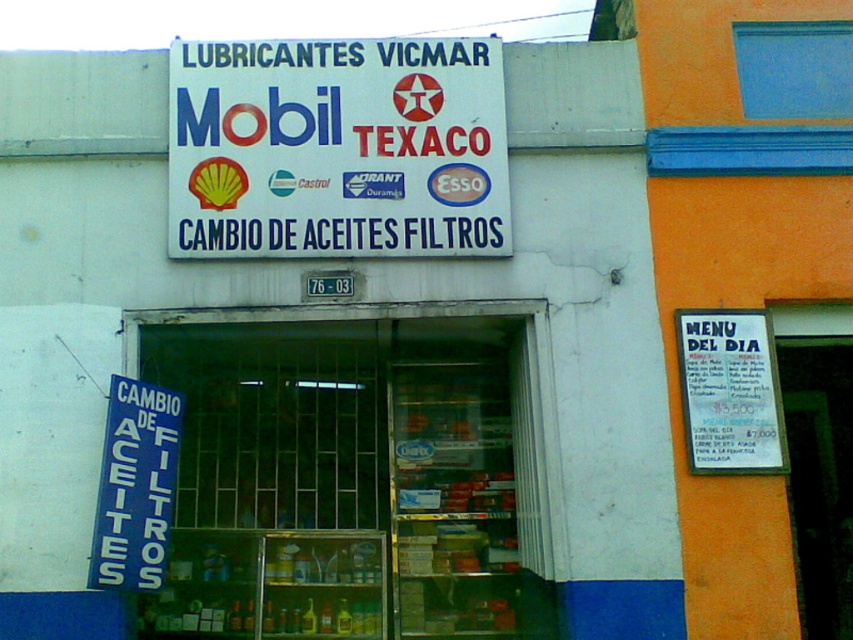
Question: Which of the following is the farthest from the observer?

Choices:
 (A) (280, 125)
 (B) (258, 540)
 (C) (759, 422)

Answer: (B)

Question: Is transparent glass door at center further to the viewer compared to blue plastic sign at lower left?

Choices:
 (A) yes
 (B) no

Answer: (A)

Question: Which object is farther from the camera taking this photo?

Choices:
 (A) white paper menu at right
 (B) blue plastic sign at lower left

Answer: (A)

Question: Among these objects, which one is nearest to the camera?

Choices:
 (A) blue plastic sign at lower left
 (B) transparent glass door at center
 (C) white paper sign at upper center

Answer: (A)

Question: Can you confirm if white paper menu at right is positioned to the left of blue plastic sign at lower left?

Choices:
 (A) yes
 (B) no

Answer: (B)

Question: Is transparent glass door at center below white paper sign at upper center?

Choices:
 (A) no
 (B) yes

Answer: (B)